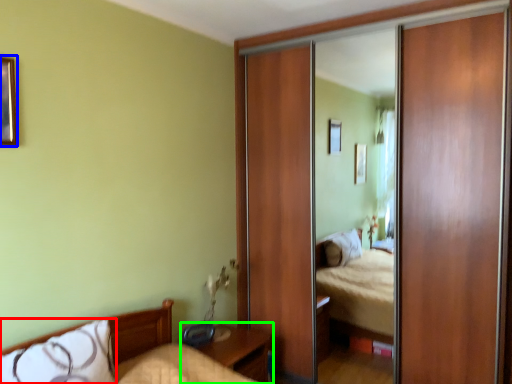
Question: Considering the real-world distances, which object is closest to pillow (highlighted by a red box)? picture frame (highlighted by a blue box) or nightstand (highlighted by a green box).

Choices:
 (A) picture frame
 (B) nightstand

Answer: (B)